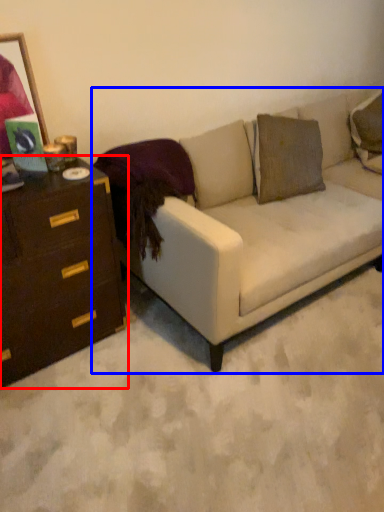
Question: Which object appears closest to the camera in this image, chest of drawers (highlighted by a red box) or studio couch (highlighted by a blue box)?

Choices:
 (A) chest of drawers
 (B) studio couch

Answer: (A)